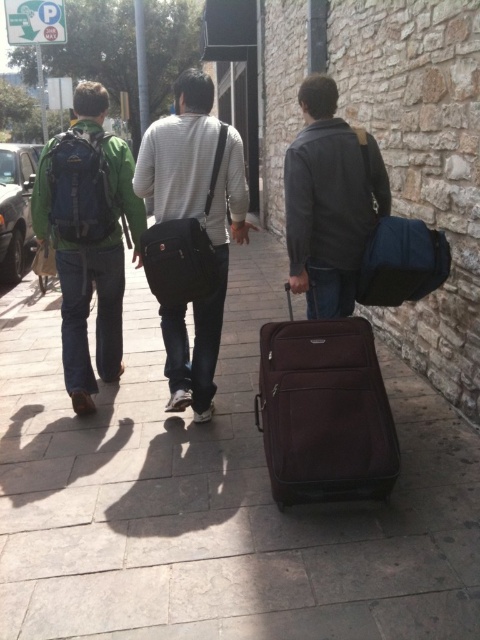
You are a photographer trying to capture a photo of the two suitcases at the center of the image. The brown smooth suitcase at center and the dark brown fabric suitcase at center. Which one should you focus on if you want to photograph the larger suitcase?

The brown smooth suitcase at center is larger in size than the dark brown fabric suitcase at center, so you should focus on the brown smooth suitcase at center.

You are standing behind three people walking away from you on a sidewalk. You see a brown smooth suitcase at center and a dark brown fabric suitcase at center. Which of these two suitcases is positioned more to the left?

The brown smooth suitcase at center is positioned more to the left than the dark brown fabric suitcase at center.